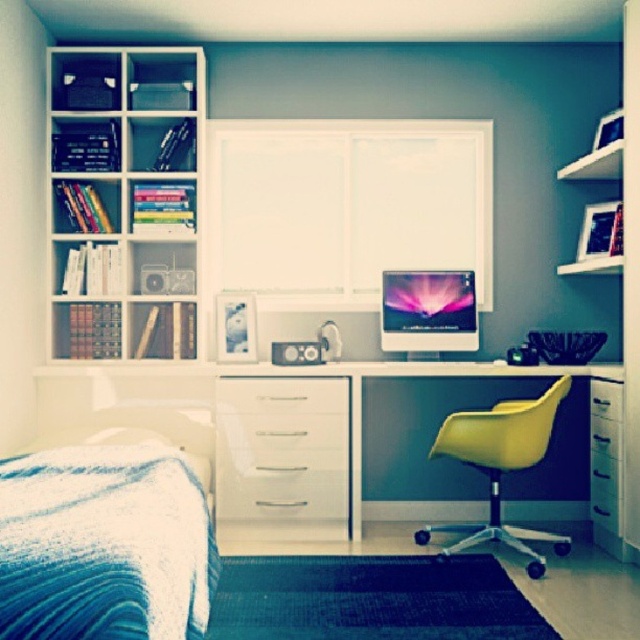
You are standing in the home office and want to place a new plant on the desk. The desk is at point 0.5, 0.5. Where should you place the plant so that it is closer to the matte white bookshelf at upper left than to the desk edge?

To place the plant closer to the matte white bookshelf at upper left, position it closer to the upper left corner of the desk since the bookshelf is located at point (125,202), which is northeast of the desk at (320,320).

You are standing in the home office and want to place a new plant on the desk. The plant requires a spot that is not directly under the matte white bookshelf at upper left. Based on the coordinates provided, can you determine if the desk surface is safe for placing the plant?

The matte white bookshelf at upper left is located at coordinates (125,202). Since the desk is positioned below the bookshelf and the coordinates indicate its placement on the upper left, the desk surface is not directly under the bookshelf. Therefore, it is safe to place the plant there.

You are standing in the home office and want to reach both the blue textured blanket at lower left and the black plastic drawer at right. Which object will you need to bend down to reach first?

The blue textured blanket at lower left is closer to the viewer than the black plastic drawer at right, so you will need to bend down to reach the blue textured blanket at lower left first.